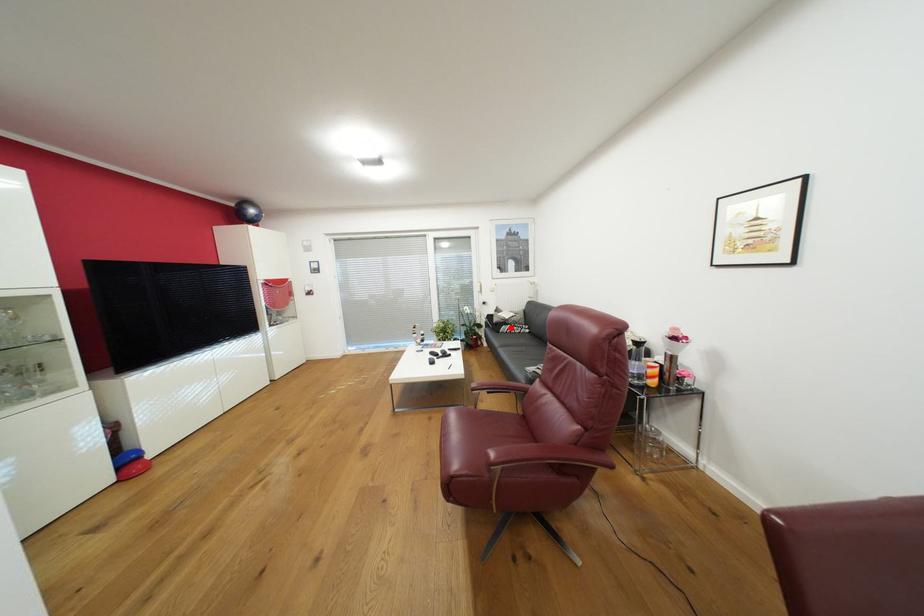
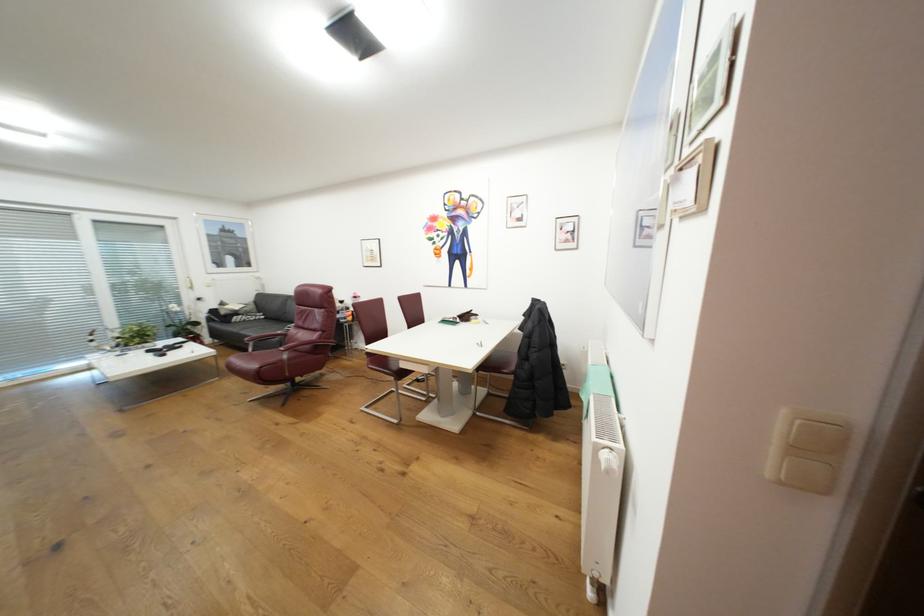
Question: I am providing you with two images of the same scene from different viewpoints. Given a red point in image1, look at the same physical point in image2. Is it:

Choices:
 (A) Closer to the viewpoint
 (B) Farther from the viewpoint

Answer: (B)